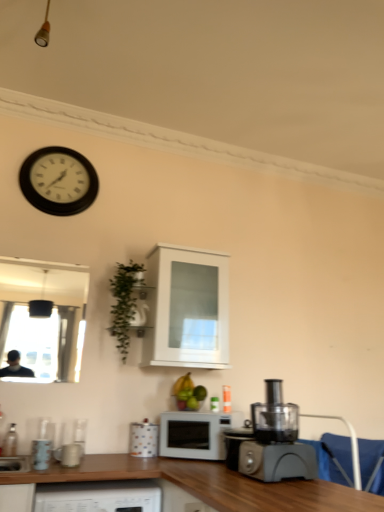
What do you see at coordinates (195, 434) in the screenshot? I see `white matte microwave at center` at bounding box center [195, 434].

What is the approximate width of clear glass bottle at lower left?

The width of clear glass bottle at lower left is 1.47 inches.

Find the location of a particular element. The height and width of the screenshot is (512, 384). blue fabric armchair at lower right is located at coordinates (372, 465).

Measure the distance between blue fabric armchair at lower right and camera.

blue fabric armchair at lower right is 2.24 meters from camera.

This screenshot has height=512, width=384. Describe the element at coordinates (123, 304) in the screenshot. I see `green leafy plant at upper left` at that location.

I want to click on matte ceramic mug at lower left, the 2th appliance in the right-to-left sequence, so click(69, 454).

Locate an element on the screen. This screenshot has height=512, width=384. white matte microwave at center is located at coordinates (195, 434).

Considering the relative positions of white glossy cabinet at upper center and matte ceramic mug at lower left, the second appliance from the back, in the image provided, is white glossy cabinet at upper center to the left or to the right of matte ceramic mug at lower left, the second appliance from the back,?

Clearly, white glossy cabinet at upper center is on the right of matte ceramic mug at lower left, the second appliance from the back, in the image.

Is white glossy cabinet at upper center smaller than matte ceramic mug at lower left, the second appliance from the back?

Incorrect, white glossy cabinet at upper center is not smaller in size than matte ceramic mug at lower left, the second appliance from the back.

From the image's perspective, is white glossy cabinet at upper center positioned above or below matte ceramic mug at lower left, the second appliance from the back?

white glossy cabinet at upper center is above matte ceramic mug at lower left, the second appliance from the back.

Considering the positions of points (226, 256) and (78, 446), is point (226, 256) closer to camera compared to point (78, 446)?

That is False.

Would you say blue fabric armchair at lower right contains white matte microwave at center?

No.

Which of these two, blue fabric armchair at lower right or white matte microwave at center, is bigger?

white matte microwave at center is bigger.

Is the position of blue fabric armchair at lower right more distant than that of white matte microwave at center?

No, blue fabric armchair at lower right is in front of white matte microwave at center.

Does point (88, 170) come farther from viewer compared to point (14, 446)?

That is True.

Which is in front, black plastic clock at upper left or clear glass bottle at lower left?

clear glass bottle at lower left is more forward.

This screenshot has height=512, width=384. I want to click on wall clock that appears above the clear glass bottle at lower left (from a real-world perspective), so click(x=58, y=181).

How different are the orientations of clear glass bottle at lower left and matte ceramic mug at lower left, the second appliance from the back, in degrees?

There is a 0.611-degree angle between the facing directions of clear glass bottle at lower left and matte ceramic mug at lower left, the second appliance from the back.

Looking at the image, does clear glass bottle at lower left seem bigger or smaller compared to matte ceramic mug at lower left, the second appliance from the back?

clear glass bottle at lower left is smaller than matte ceramic mug at lower left, the second appliance from the back.

Considering the positions of objects clear glass bottle at lower left and matte ceramic mug at lower left, the 2th appliance in the right-to-left sequence, in the image provided, who is in front, clear glass bottle at lower left or matte ceramic mug at lower left, the 2th appliance in the right-to-left sequence,?

matte ceramic mug at lower left, the 2th appliance in the right-to-left sequence.

Is point (14, 435) closer to viewer compared to point (67, 448)?

No, it is not.

How many degrees apart are the facing directions of clear glass bottle at lower left and polka dot ceramic mug at lower center, which is the first appliance from right to left?

They differ by 5.38 degrees in their facing directions.

Which object is closer to the camera, clear glass bottle at lower left or polka dot ceramic mug at lower center, the second appliance when ordered from left to right?

clear glass bottle at lower left is in front.

Is clear glass bottle at lower left thinner than polka dot ceramic mug at lower center, which is the first appliance from right to left?

Correct, the width of clear glass bottle at lower left is less than that of polka dot ceramic mug at lower center, which is the first appliance from right to left.

Looking at this image, does clear glass bottle at lower left contain polka dot ceramic mug at lower center, which is the first appliance from right to left?

No, polka dot ceramic mug at lower center, which is the first appliance from right to left, is not a part of clear glass bottle at lower left.

Is the depth of matte ceramic mug at lower left, the 1th appliance viewed from the left, greater than that of clear glass bottle at lower left?

No, matte ceramic mug at lower left, the 1th appliance viewed from the left, is closer to the viewer.

Is matte ceramic mug at lower left, the 2th appliance in the right-to-left sequence, inside the boundaries of clear glass bottle at lower left, or outside?

matte ceramic mug at lower left, the 2th appliance in the right-to-left sequence, is outside clear glass bottle at lower left.

Is matte ceramic mug at lower left, the 1th appliance viewed from the left, bigger than clear glass bottle at lower left?

Indeed, matte ceramic mug at lower left, the 1th appliance viewed from the left, has a larger size compared to clear glass bottle at lower left.

In the scene shown: From a real-world perspective, which object stands above the other?

clear glass bottle at lower left, from a real-world perspective.

Is point (349, 473) in front of point (190, 284)?

Yes, point (349, 473) is in front of point (190, 284).

Is blue fabric armchair at lower right thinner than white glossy cabinet at upper center?

Yes, blue fabric armchair at lower right is thinner than white glossy cabinet at upper center.

Is blue fabric armchair at lower right beside white glossy cabinet at upper center?

blue fabric armchair at lower right and white glossy cabinet at upper center are not in contact.

Find the location of a particular element. The width and height of the screenshot is (384, 512). cabinetry above the blue fabric armchair at lower right (from a real-world perspective) is located at coordinates (187, 309).

From the white glossy cabinet at upper center, count 2nd appliances forward and point to it. Please provide its 2D coordinates.

[(69, 454)]

Locate an element on the screen. armchair to the right of white matte microwave at center is located at coordinates (372, 465).

Looking at the image, which one is located further to black plastic clock at upper left, matte ceramic mug at lower left, the 2th appliance in the right-to-left sequence, or white glossy cabinet at upper center?

matte ceramic mug at lower left, the 2th appliance in the right-to-left sequence, lies further to black plastic clock at upper left than the other object.

Which object lies further to the anchor point black plastic food processor at lower right, clear glass bottle at lower left or matte ceramic mug at lower left, the second appliance from the back?

clear glass bottle at lower left is further to black plastic food processor at lower right.

Which object lies nearer to the anchor point blue fabric armchair at lower right, white matte microwave at center or black plastic clock at upper left?

white matte microwave at center lies closer to blue fabric armchair at lower right than the other object.

Which object lies nearer to the anchor point polka dot ceramic mug at lower center, which is the first appliance from right to left, black plastic food processor at lower right or green leafy plant at upper left?

The object closer to polka dot ceramic mug at lower center, which is the first appliance from right to left, is green leafy plant at upper left.

Looking at the image, which one is located further to clear glass bottle at lower left, black plastic food processor at lower right or white glossy cabinet at upper center?

black plastic food processor at lower right is further to clear glass bottle at lower left.

Considering their positions, is black plastic food processor at lower right positioned further to white glossy cabinet at upper center than clear glass bottle at lower left?

clear glass bottle at lower left is positioned further to the anchor white glossy cabinet at upper center.

Looking at the image, which one is located closer to clear glass bottle at lower left, black plastic clock at upper left or matte ceramic mug at lower left, the second appliance from the back?

Among the two, matte ceramic mug at lower left, the second appliance from the back, is located nearer to clear glass bottle at lower left.

Which object lies further to the anchor point black plastic food processor at lower right, matte ceramic mug at lower left, the 2th appliance in the right-to-left sequence, or white matte microwave at center?

matte ceramic mug at lower left, the 2th appliance in the right-to-left sequence, lies further to black plastic food processor at lower right than the other object.

I want to click on cabinetry between black plastic clock at upper left and white matte microwave at center from top to bottom, so click(187, 309).

Find the location of a particular element. home appliance between matte ceramic mug at lower left, the 1th appliance viewed from the left, and blue fabric armchair at lower right from left to right is located at coordinates (276, 441).

The height and width of the screenshot is (512, 384). I want to click on appliance situated between green leafy plant at upper left and blue fabric armchair at lower right from left to right, so click(x=143, y=439).

Where is `home appliance between black plastic clock at upper left and white matte microwave at center vertically`? home appliance between black plastic clock at upper left and white matte microwave at center vertically is located at coordinates (276, 441).